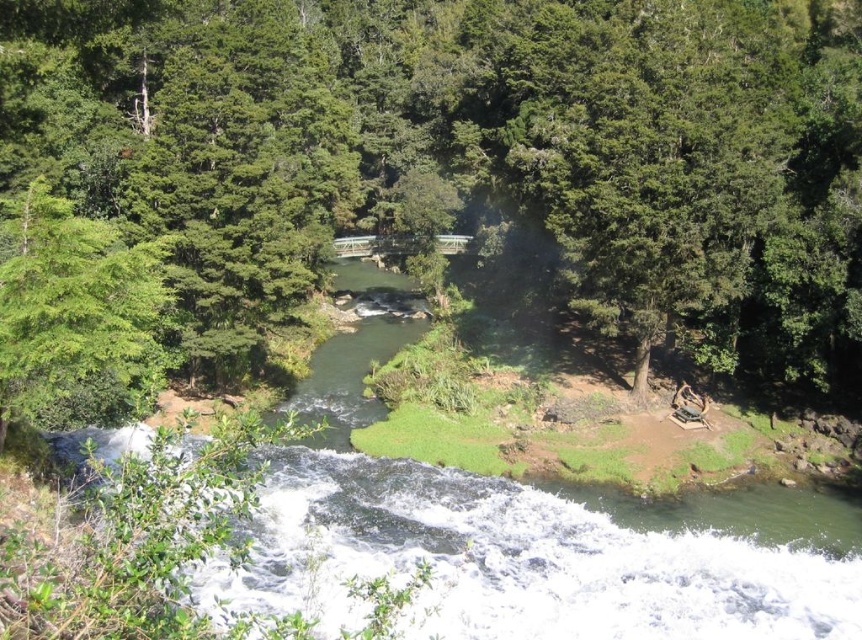
Question: Among these objects, which one is farthest from the camera?

Choices:
 (A) green leafy tree at left
 (B) green leafy tree at upper right

Answer: (B)

Question: Is green leafy tree at center to the right of green leafy tree at left from the viewer's perspective?

Choices:
 (A) no
 (B) yes

Answer: (B)

Question: Which point is closer to the camera?

Choices:
 (A) (590, 205)
 (B) (27, 243)

Answer: (B)

Question: In this image, where is green leafy tree at center located relative to green leafy tree at upper right?

Choices:
 (A) left
 (B) right

Answer: (A)

Question: Is green leafy tree at center thinner than green leafy tree at upper right?

Choices:
 (A) yes
 (B) no

Answer: (B)

Question: Which of the following is the farthest from the observer?

Choices:
 (A) (689, 96)
 (B) (103, 305)
 (C) (202, 144)

Answer: (C)